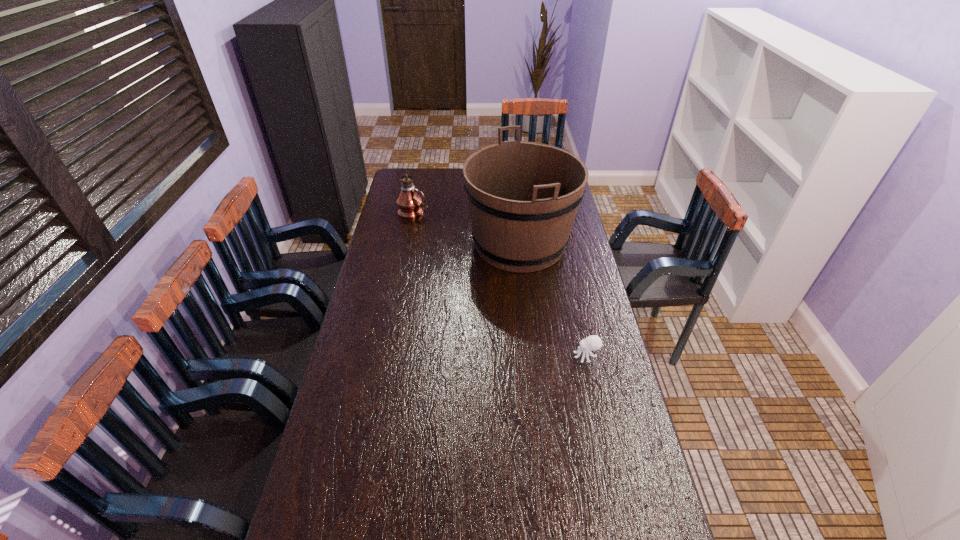
Where is `object that stands as the second closest to the tallest object`? The height and width of the screenshot is (540, 960). object that stands as the second closest to the tallest object is located at coordinates (591, 343).

Locate which object ranks in proximity to the oil lamp. Please provide its 2D coordinates. Your answer should be formatted as a tuple, i.e. [(x, y)], where the tuple contains the x and y coordinates of a point satisfying the conditions above.

[(523, 197)]